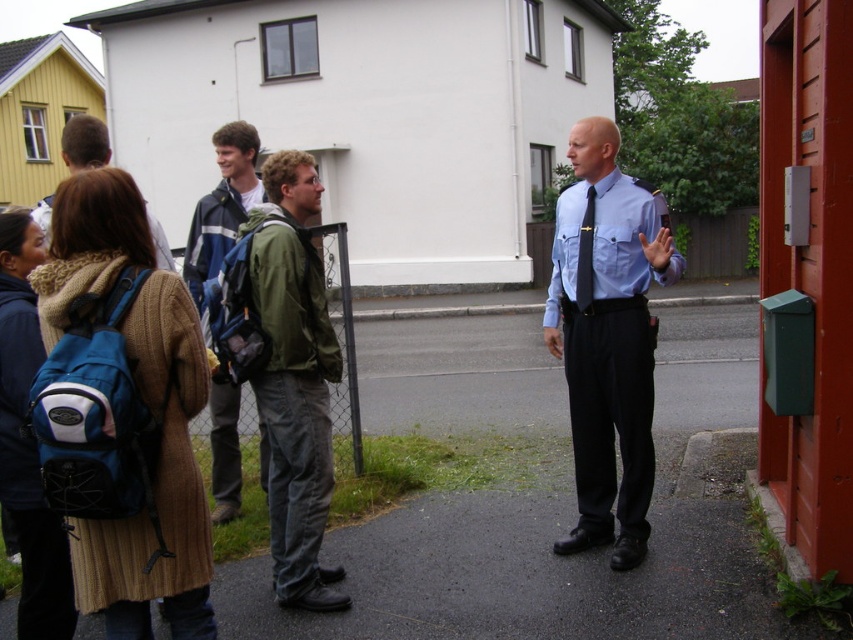
Question: Which point is closer to the camera?

Choices:
 (A) (624, 236)
 (B) (161, 248)

Answer: (A)

Question: Is the position of green matte jacket at center less distant than that of brown woolen coat at left?

Choices:
 (A) yes
 (B) no

Answer: (B)

Question: Considering the real-world distances, which object is farthest from the brown woolen coat at left?

Choices:
 (A) light blue shirt at center
 (B) blue backpack at center

Answer: (B)

Question: In this image, where is green matte jacket at center located relative to brown woolen coat at left?

Choices:
 (A) left
 (B) right

Answer: (B)

Question: Which object appears closest to the camera in this image?

Choices:
 (A) blue backpack at center
 (B) light blue shirt at center

Answer: (B)

Question: Is the position of green matte jacket at center more distant than that of brown woolen coat at left?

Choices:
 (A) no
 (B) yes

Answer: (B)